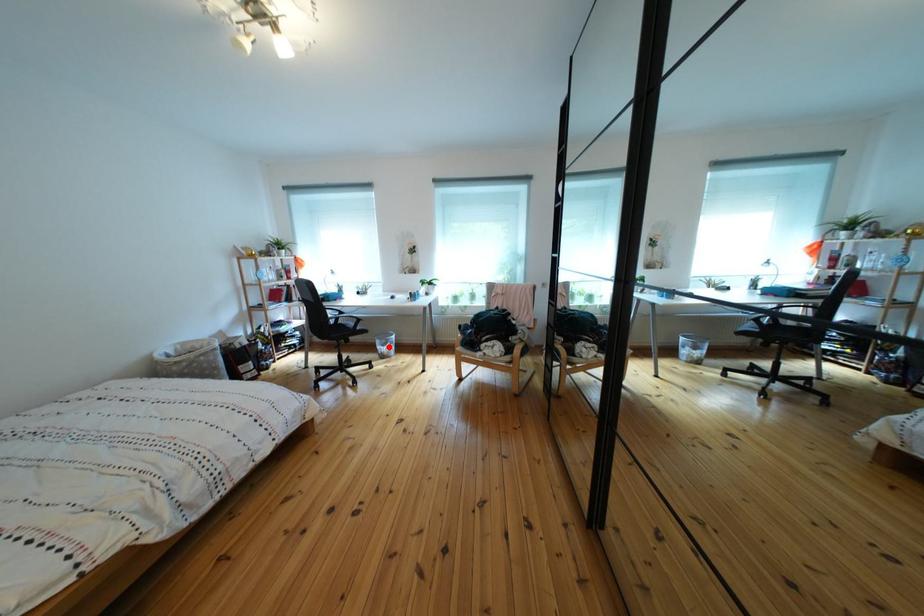
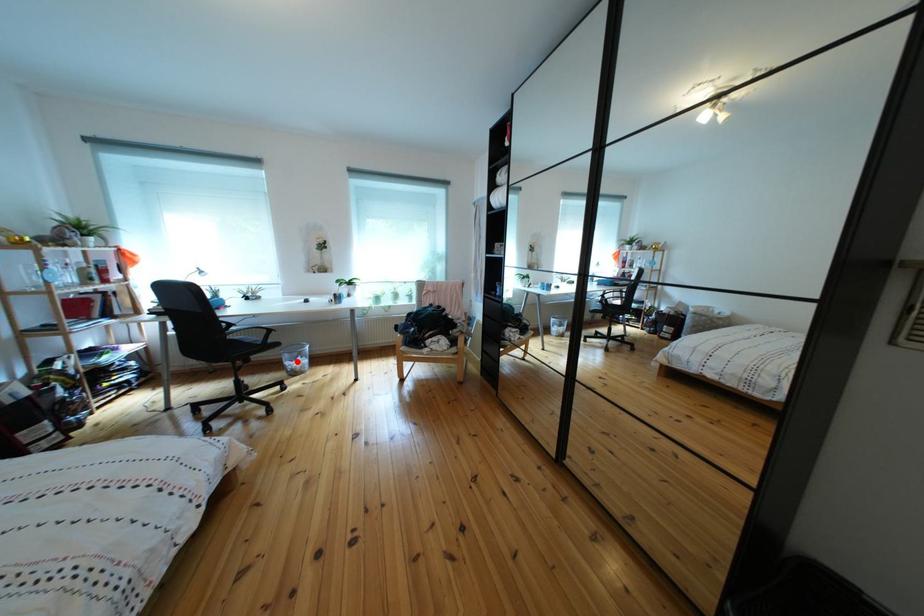
I am providing you with two images of the same scene from different viewpoints. A red point is marked on the first image and another point is marked on the second image. Is the marked point in image1 the same physical position as the marked point in image2?

Yes